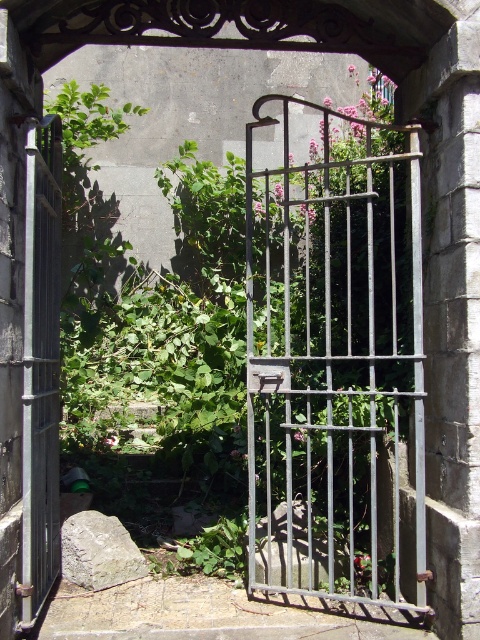
Question: Which object is closer to the camera taking this photo?

Choices:
 (A) metallic gate at center
 (B) dark gray metal gate at left

Answer: (B)

Question: Can you confirm if metallic gate at center is positioned below dark gray metal gate at left?

Choices:
 (A) no
 (B) yes

Answer: (A)

Question: Considering the relative positions of metallic gate at center and dark gray metal gate at left in the image provided, where is metallic gate at center located with respect to dark gray metal gate at left?

Choices:
 (A) above
 (B) below

Answer: (A)

Question: Where is metallic gate at center located in relation to dark gray metal gate at left in the image?

Choices:
 (A) right
 (B) left

Answer: (A)